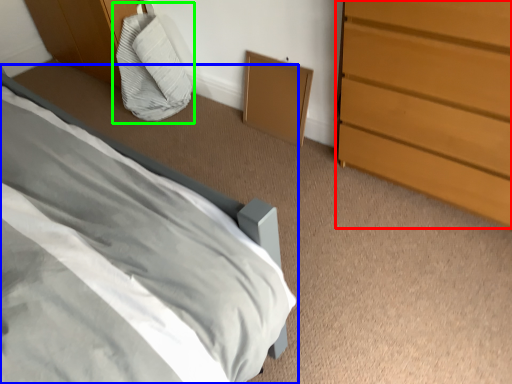
Question: Based on their relative distances, which object is nearer to chest of drawers (highlighted by a red box)? Choose from bed (highlighted by a blue box) and bean bag chair (highlighted by a green box).

Choices:
 (A) bed
 (B) bean bag chair

Answer: (A)